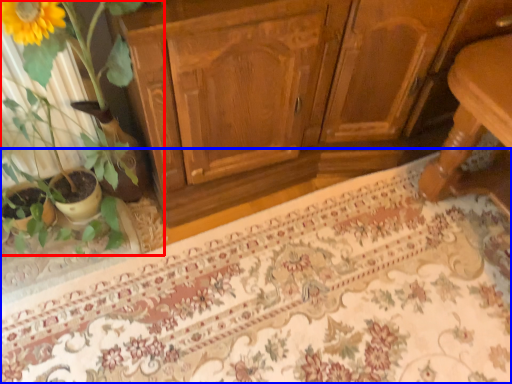
Question: Which point is further to the camera, houseplant (highlighted by a red box) or doormat (highlighted by a blue box)?

Choices:
 (A) houseplant
 (B) doormat

Answer: (B)